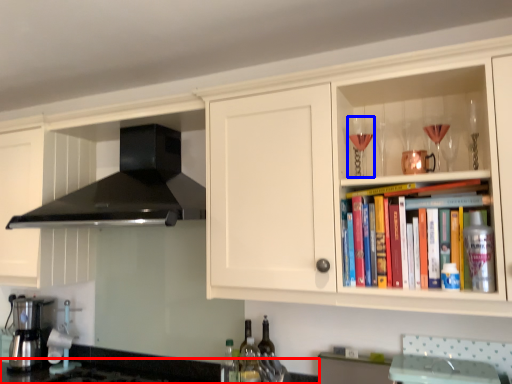
Question: Among these objects, which one is farthest to the camera, countertop (highlighted by a red box) or wine glass (highlighted by a blue box)?

Choices:
 (A) countertop
 (B) wine glass

Answer: (B)